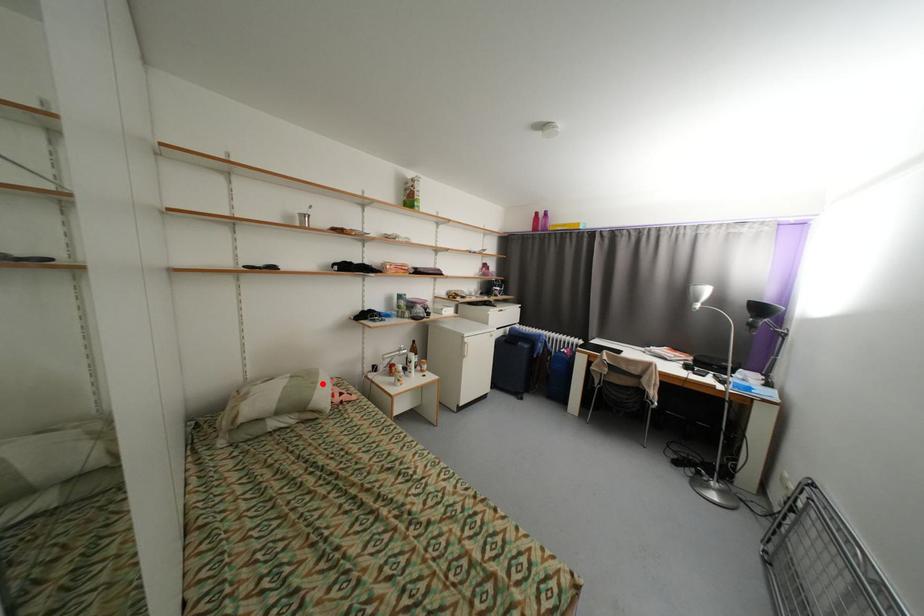
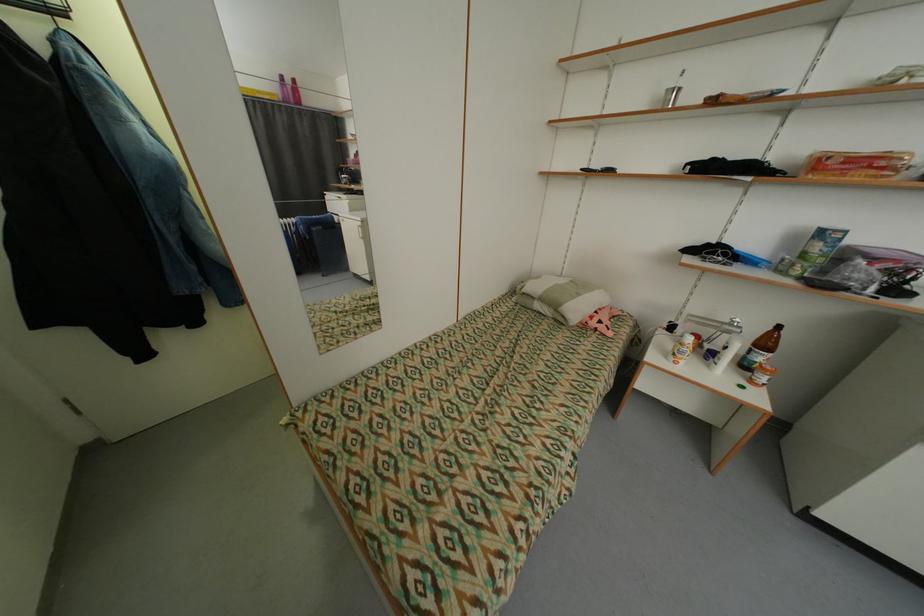
Question: A red point is marked in image1. In image2, is the corresponding 3D point closer to the camera or farther? Reply with the corresponding letter.

Choices:
 (A) The corresponding 3D point is closer.
 (B) The corresponding 3D point is farther.

Answer: (B)